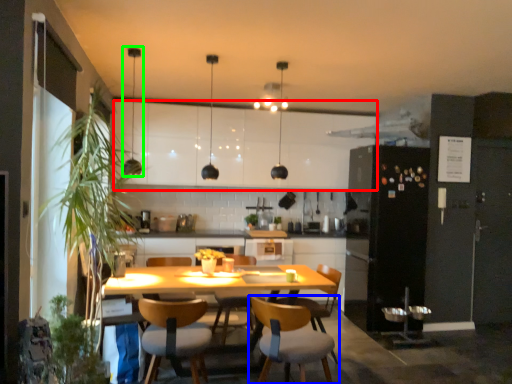
Question: Which object is positioned farthest from cabinetry (highlighted by a red box)? Select from chair (highlighted by a blue box) and light fixture (highlighted by a green box).

Choices:
 (A) chair
 (B) light fixture

Answer: (A)